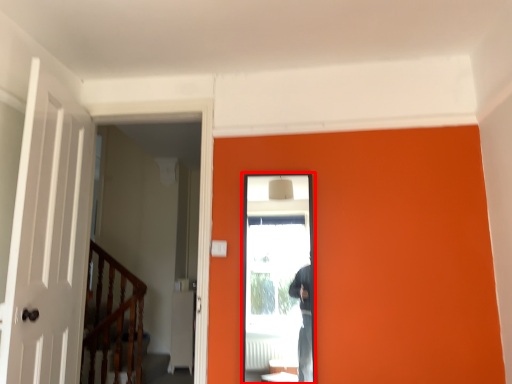
Question: Considering the relative positions of screen door (annotated by the red box) and rail in the image provided, where is screen door (annotated by the red box) located with respect to the staircase?

Choices:
 (A) left
 (B) right

Answer: (B)